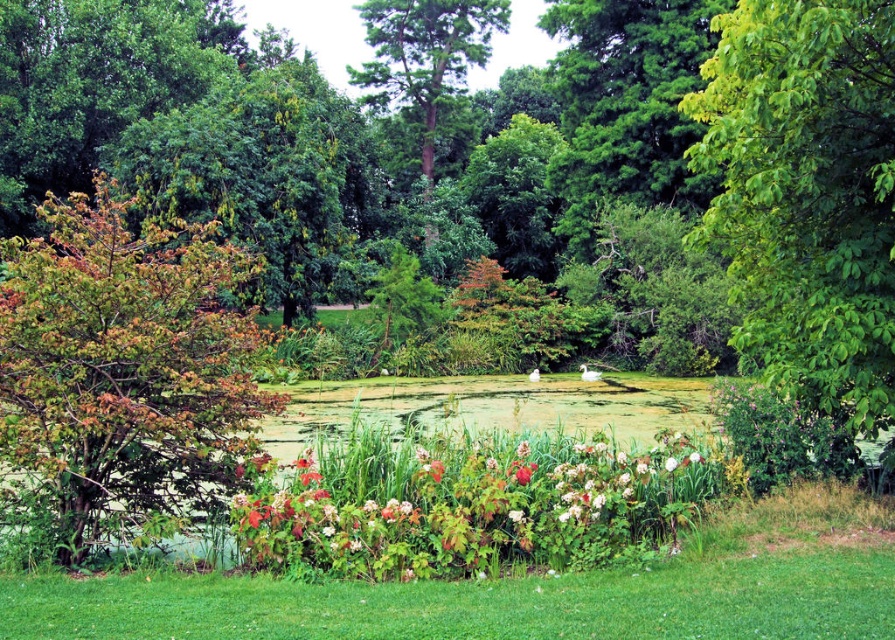
Measure the distance between multicolored foliage bush at left and green leafy bush at center.

multicolored foliage bush at left is 10.50 feet away from green leafy bush at center.

Which is more to the right, multicolored foliage bush at left or green leafy bush at center?

From the viewer's perspective, green leafy bush at center appears more on the right side.

Between point (160, 230) and point (524, 532), which one is positioned in front?

Point (524, 532) is more forward.

Where is `multicolored foliage bush at left`? The height and width of the screenshot is (640, 895). multicolored foliage bush at left is located at coordinates (124, 371).

Between green leafy bush at center and green textured tree at center, which one appears on the right side from the viewer's perspective?

Positioned to the right is green leafy bush at center.

Based on the photo, measure the distance between point (479,541) and camera.

The distance of point (479,541) from camera is 25.84 feet.

Locate an element on the screen. The image size is (895, 640). green leafy bush at center is located at coordinates (473, 502).

Measure the distance from multicolored foliage bush at left to green textured tree at center.

The distance of multicolored foliage bush at left from green textured tree at center is 19.67 meters.

Who is higher up, multicolored foliage bush at left or green textured tree at center?

Positioned higher is green textured tree at center.

This screenshot has height=640, width=895. Find the location of `multicolored foliage bush at left`. multicolored foliage bush at left is located at coordinates pyautogui.click(x=124, y=371).

Identify the location of multicolored foliage bush at left. This screenshot has width=895, height=640. (124, 371).